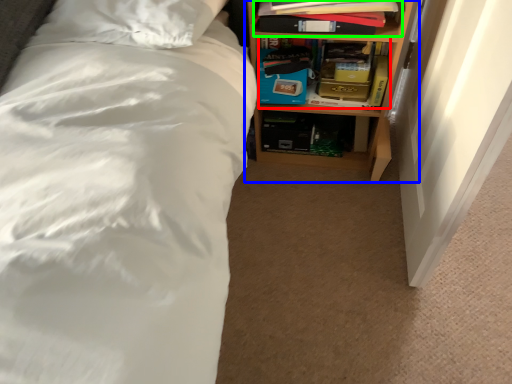
Question: Which object is positioned closest to book (highlighted by a red box)? Select from shelf (highlighted by a blue box) and book (highlighted by a green box).

Choices:
 (A) shelf
 (B) book

Answer: (A)